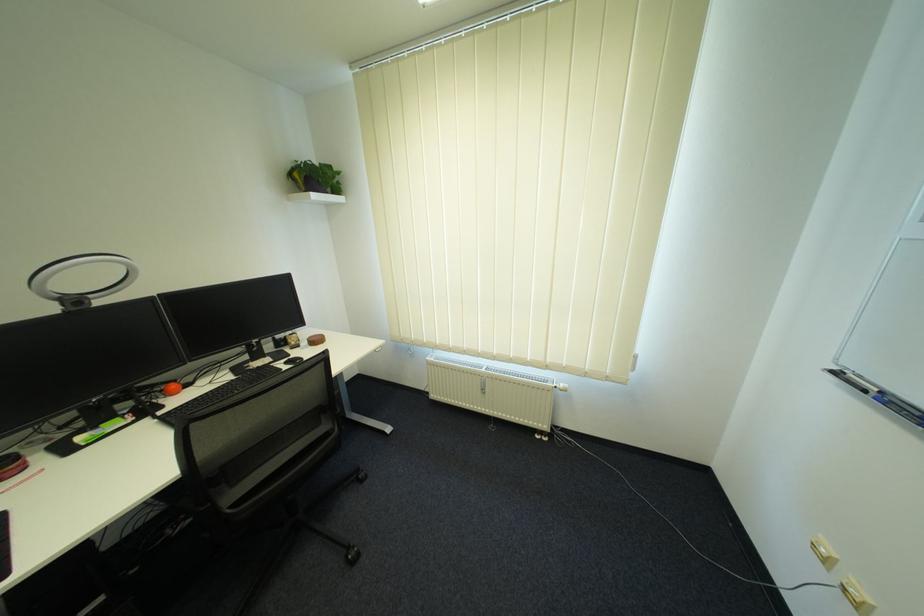
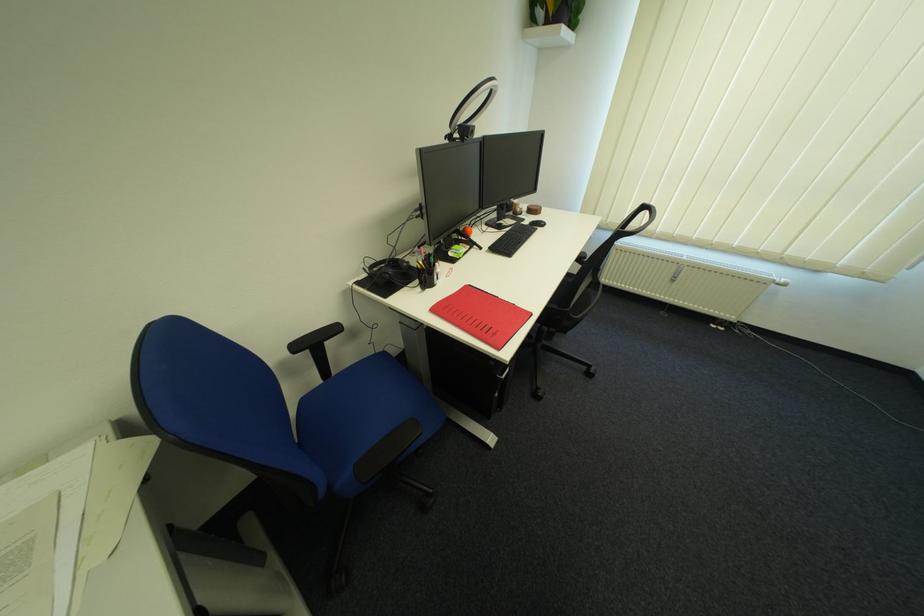
In the second image, find the point that corresponds to the point at 572,387 in the first image.

(793, 281)